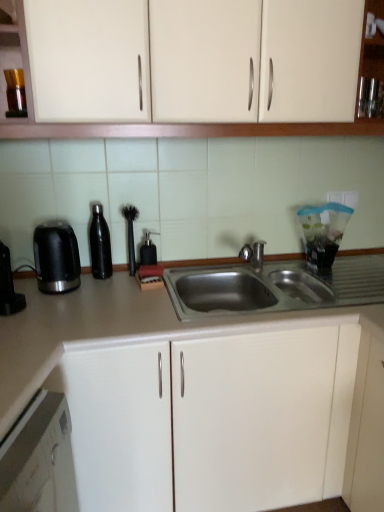
Image resolution: width=384 pixels, height=512 pixels. In order to click on blank space situated above matte gray countertop at center (from a real-world perspective) in this screenshot , I will do `click(160, 295)`.